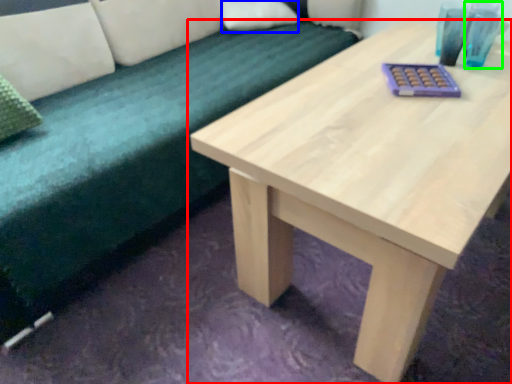
Question: Which is nearer to the table (highlighted by a red box)? pillow (highlighted by a blue box) or teal (highlighted by a green box).

Choices:
 (A) pillow
 (B) teal

Answer: (B)